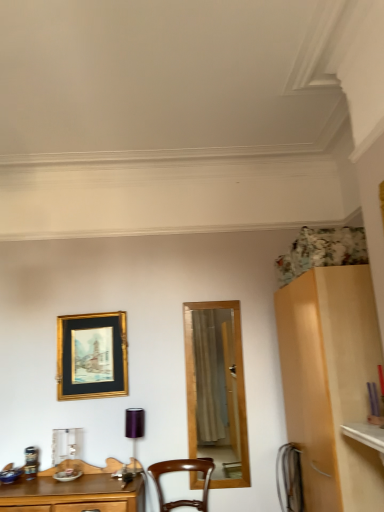
Find the location of a particular element. free location above gold/glossy picture frame at upper left (from a real-world perspective) is located at coordinates (98, 311).